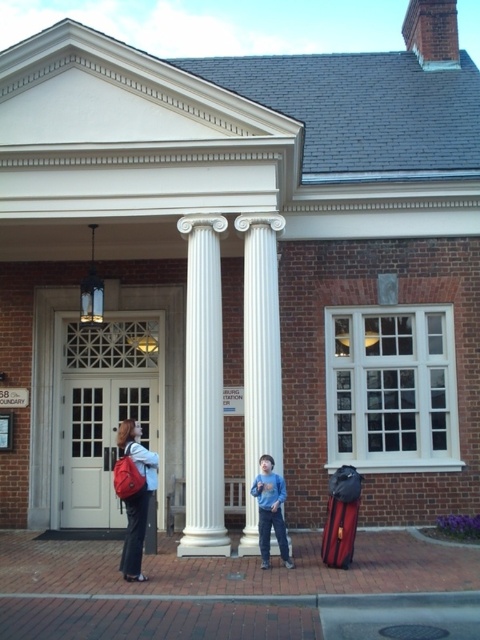
You are standing in front of the brick building and want to enter through the entrance. Which column should you walk between to reach the entrance? The white glossy column at center or the white marble column at center?

You should walk between the white glossy column at center and the white marble column at center because the white glossy column at center is positioned under the white marble column at center, indicating they form a single structure above the entrance.

You are a delivery person trying to decide whether to place a large package next to the matte red backpack at left or the blue cotton shirt at center. Based on their sizes, which object can accommodate a larger package?

The matte red backpack at left has a larger size compared to the blue cotton shirt at center, so the matte red backpack at left can accommodate a larger package.